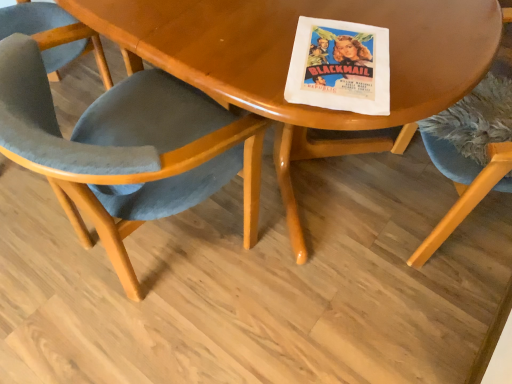
Question: Looking at the image, does velvet blue chair at center, acting as the 2th chair starting from the right, seem bigger or smaller compared to velvet blue chair at right, the second chair from the left?

Choices:
 (A) big
 (B) small

Answer: (B)

Question: From a real-world perspective, relative to velvet blue chair at right, marked as the first chair in a right-to-left arrangement, is velvet blue chair at center, acting as the 2th chair starting from the right, vertically above or below?

Choices:
 (A) above
 (B) below

Answer: (B)

Question: Based on their relative distances, which object is farther from the velvet blue chair at center, acting as the first chair starting from the left?

Choices:
 (A) wooden table at center
 (B) velvet blue chair at right, the second chair from the left

Answer: (B)

Question: Which object is the closest to the velvet blue chair at right, marked as the first chair in a right-to-left arrangement?

Choices:
 (A) wooden table at center
 (B) velvet blue chair at center, acting as the first chair starting from the left

Answer: (A)